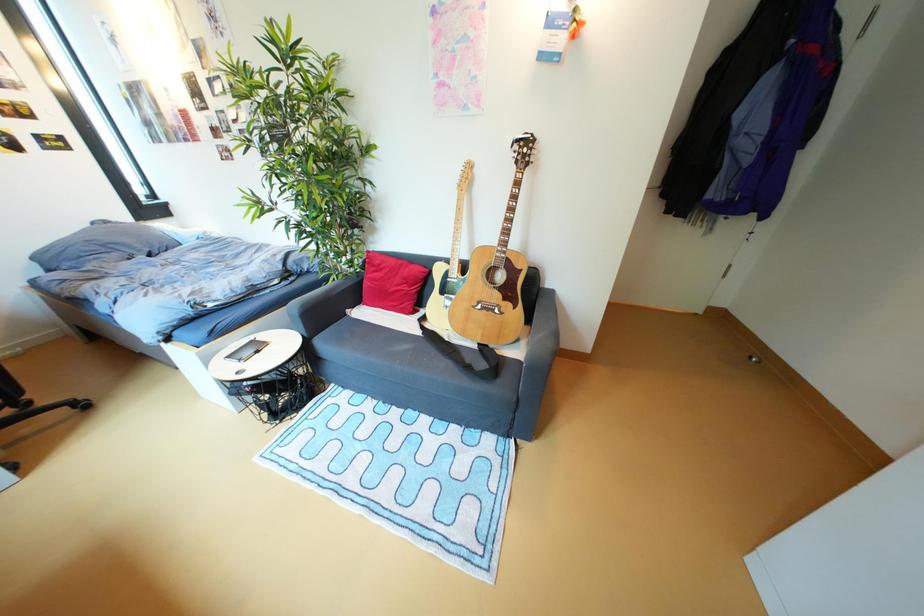
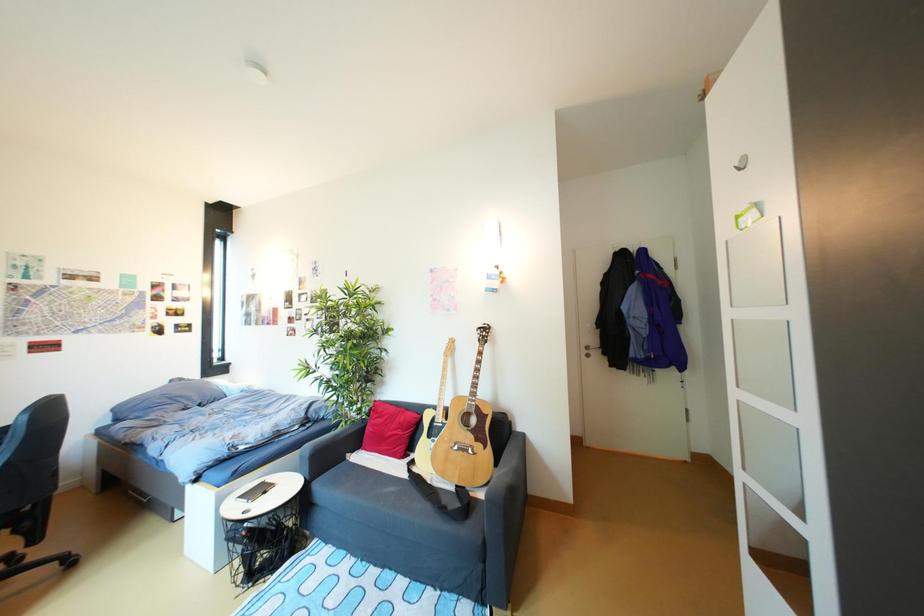
Question: Based on the continuous images, in which direction is the camera rotating? Reply with the corresponding letter.

Choices:
 (A) Left
 (B) Right
 (C) Up
 (D) Down

Answer: (C)